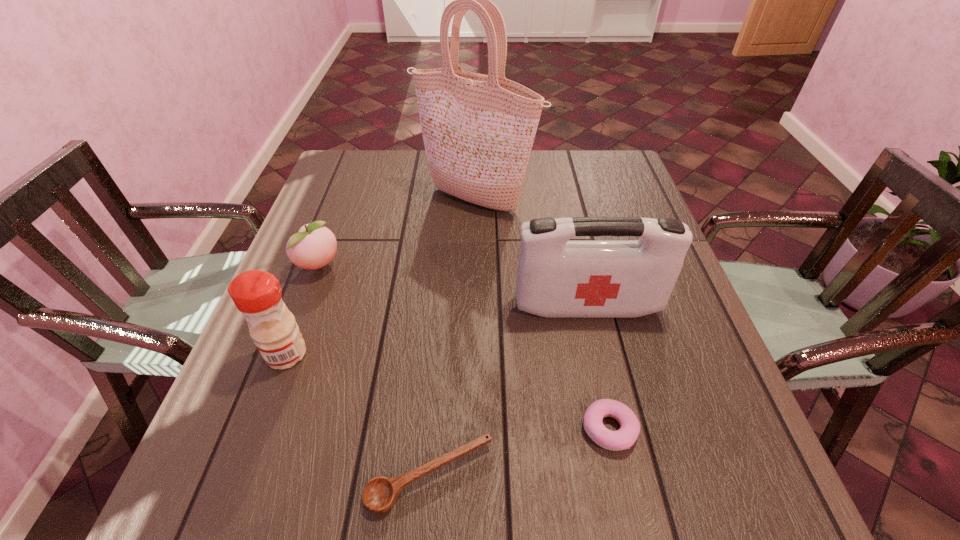
The width and height of the screenshot is (960, 540). What are the coordinates of `free space located 0.210m on the right of the third nearest object` in the screenshot? It's located at (413, 354).

The width and height of the screenshot is (960, 540). In order to click on vacant space positioned on the front of the fourth tallest object in this screenshot , I will do `click(293, 337)`.

Image resolution: width=960 pixels, height=540 pixels. In order to click on vacant space located on the left of the fifth tallest object in this screenshot , I will do `click(542, 429)`.

Where is `free space located on the right of the wooden spoon`? Image resolution: width=960 pixels, height=540 pixels. free space located on the right of the wooden spoon is located at coordinates (560, 476).

Locate an element on the screen. This screenshot has height=540, width=960. object positioned at the far edge is located at coordinates (478, 130).

What are the coordinates of `object that is at the near edge` in the screenshot? It's located at (380, 494).

The image size is (960, 540). In order to click on condiment at the left edge in this screenshot , I will do `click(257, 294)`.

This screenshot has height=540, width=960. In order to click on peach located at the left edge in this screenshot , I will do click(x=314, y=246).

Locate an element on the screen. object at the right edge is located at coordinates (556, 278).

Where is `vacant space at the far edge of the desktop`? The height and width of the screenshot is (540, 960). vacant space at the far edge of the desktop is located at coordinates (418, 159).